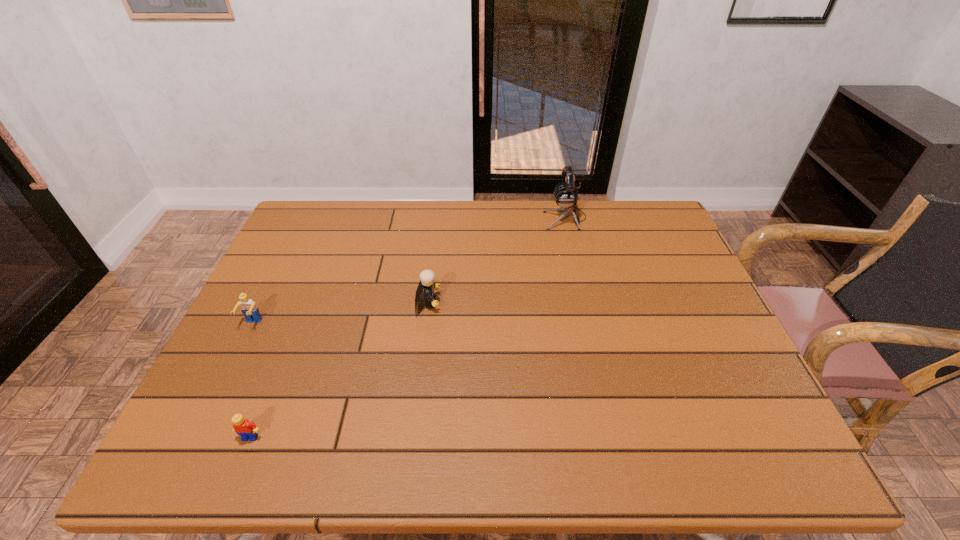
This screenshot has height=540, width=960. Identify the location of free space between the third shortest object and the farthest object. (496, 260).

Where is `free space between the leftmost Lego and the second Lego from right to left`? free space between the leftmost Lego and the second Lego from right to left is located at coordinates (252, 381).

Find the location of `vacant area that lies between the leftmost object and the tallest Lego`. vacant area that lies between the leftmost object and the tallest Lego is located at coordinates (340, 313).

Where is `vacant region between the rightmost object and the rightmost Lego`? The height and width of the screenshot is (540, 960). vacant region between the rightmost object and the rightmost Lego is located at coordinates (496, 260).

The width and height of the screenshot is (960, 540). Find the location of `free space between the nearest Lego and the tallest object`. free space between the nearest Lego and the tallest object is located at coordinates [x=408, y=327].

Locate an element on the screen. The width and height of the screenshot is (960, 540). free space between the rightmost object and the leftmost object is located at coordinates (409, 271).

Where is `unoccupied area between the second object from left to right and the leftmost Lego`? The width and height of the screenshot is (960, 540). unoccupied area between the second object from left to right and the leftmost Lego is located at coordinates (252, 381).

Find the location of a particular element. The height and width of the screenshot is (540, 960). free spot between the leftmost object and the rightmost Lego is located at coordinates (340, 313).

I want to click on unoccupied position between the tallest Lego and the leftmost Lego, so pyautogui.click(x=340, y=313).

Identify which object is the third nearest to the nearest object. Please provide its 2D coordinates. Your answer should be formatted as a tuple, i.e. [(x, y)], where the tuple contains the x and y coordinates of a point satisfying the conditions above.

[(566, 195)]